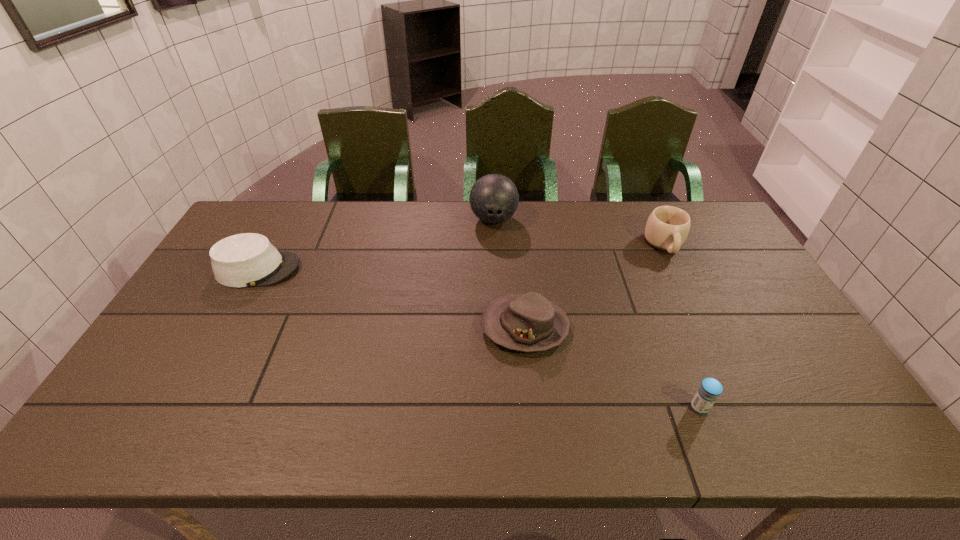
Identify the location of free space located 0.290m on the front-facing side of the left hat. This screenshot has height=540, width=960. (392, 269).

Locate an element on the screen. The height and width of the screenshot is (540, 960). vacant space located on the decorative side of the second nearest object is located at coordinates (378, 327).

Find the location of `free space located on the decorative side of the second nearest object`. free space located on the decorative side of the second nearest object is located at coordinates (342, 327).

Image resolution: width=960 pixels, height=540 pixels. In order to click on free space located 0.090m on the decorative side of the second nearest object in this screenshot , I will do `click(447, 327)`.

Identify the location of free spot located 0.260m on the left of the nearest object. The image size is (960, 540). (579, 408).

Find the location of a particular element. The height and width of the screenshot is (540, 960). bowling ball situated at the far edge is located at coordinates (494, 198).

Where is `mug located in the far edge section of the desktop`? The image size is (960, 540). mug located in the far edge section of the desktop is located at coordinates (667, 228).

Where is `object at the near edge`? This screenshot has width=960, height=540. object at the near edge is located at coordinates (707, 394).

Locate an element on the screen. object located at the left edge is located at coordinates (244, 260).

This screenshot has width=960, height=540. In order to click on vacant point at the far edge in this screenshot , I will do `click(450, 238)`.